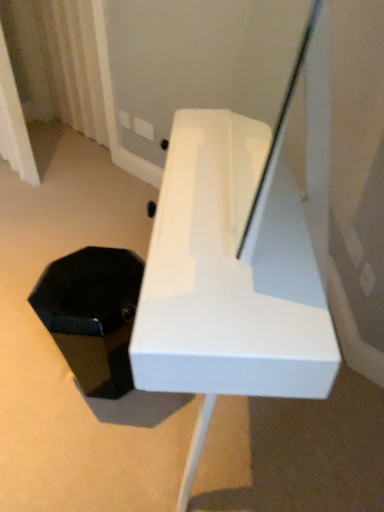
Locate an element on the screen. white sheer curtain at upper left is located at coordinates (73, 65).

Describe the element at coordinates (92, 315) in the screenshot. I see `black matte hexagonal box at lower left` at that location.

Locate an element on the screen. The width and height of the screenshot is (384, 512). white glossy bench at center is located at coordinates (229, 279).

From the picture: Does white glossy bench at center lie behind white sheer curtain at upper left?

No, white glossy bench at center is closer to the viewer.

Looking at this image, could you tell me if white glossy bench at center is facing white sheer curtain at upper left?

No, white glossy bench at center is not turned towards white sheer curtain at upper left.

Considering the sizes of objects white glossy bench at center and white sheer curtain at upper left in the image provided, who is shorter, white glossy bench at center or white sheer curtain at upper left?

With less height is white glossy bench at center.

In the scene shown: Is white glossy bench at center smaller than white sheer curtain at upper left?

No, white glossy bench at center is not smaller than white sheer curtain at upper left.

Can we say white sheer curtain at upper left lies outside black matte hexagonal box at lower left?

white sheer curtain at upper left is positioned outside black matte hexagonal box at lower left.

Which of these two, white sheer curtain at upper left or black matte hexagonal box at lower left, is wider?

Wider between the two is black matte hexagonal box at lower left.

From the picture: Is white sheer curtain at upper left at the left side of black matte hexagonal box at lower left?

Indeed, white sheer curtain at upper left is positioned on the left side of black matte hexagonal box at lower left.

From a real-world perspective, relative to black matte hexagonal box at lower left, is white sheer curtain at upper left vertically above or below?

From a real-world perspective, white sheer curtain at upper left is physically above black matte hexagonal box at lower left.

In the image, is black matte hexagonal box at lower left positioned in front of or behind white sheer curtain at upper left?

Visually, black matte hexagonal box at lower left is located in front of white sheer curtain at upper left.

Considering the relative positions of black matte hexagonal box at lower left and white sheer curtain at upper left in the image provided, is black matte hexagonal box at lower left to the left or to the right of white sheer curtain at upper left?

Clearly, black matte hexagonal box at lower left is on the right of white sheer curtain at upper left in the image.

Would you say black matte hexagonal box at lower left is a long distance from white sheer curtain at upper left?

Indeed, black matte hexagonal box at lower left is not near white sheer curtain at upper left.

Is black matte hexagonal box at lower left completely or partially outside of white sheer curtain at upper left?

Absolutely, black matte hexagonal box at lower left is external to white sheer curtain at upper left.

Is point (233, 287) positioned after point (107, 261)?

No, it is in front of (107, 261).

From the image's perspective, who appears lower, white glossy bench at center or black matte hexagonal box at lower left?

black matte hexagonal box at lower left appears lower in the image.

Which object is more forward, white glossy bench at center or black matte hexagonal box at lower left?

white glossy bench at center is closer to the camera.

Can you tell me how much white glossy bench at center and black matte hexagonal box at lower left differ in facing direction?

The angular difference between white glossy bench at center and black matte hexagonal box at lower left is 173 degrees.

Can you confirm if white sheer curtain at upper left is positioned to the left of white glossy bench at center?

Yes.

From a real-world perspective, between white sheer curtain at upper left and white glossy bench at center, who is vertically higher?

From a 3D spatial view, white sheer curtain at upper left is above.

Is white sheer curtain at upper left inside or outside of white glossy bench at center?

white sheer curtain at upper left is not enclosed by white glossy bench at center.

From a real-world perspective, relative to white glossy bench at center, is black matte hexagonal box at lower left vertically above or below?

From a real-world perspective, black matte hexagonal box at lower left is physically below white glossy bench at center.

How different are the orientations of black matte hexagonal box at lower left and white glossy bench at center in degrees?

black matte hexagonal box at lower left and white glossy bench at center are facing 173 degrees away from each other.

Considering the relative sizes of black matte hexagonal box at lower left and white glossy bench at center in the image provided, is black matte hexagonal box at lower left wider than white glossy bench at center?

No, black matte hexagonal box at lower left is not wider than white glossy bench at center.

Considering the relative sizes of black matte hexagonal box at lower left and white glossy bench at center in the image provided, is black matte hexagonal box at lower left bigger than white glossy bench at center?

Actually, black matte hexagonal box at lower left might be smaller than white glossy bench at center.

The image size is (384, 512). Identify the location of furniture below the white sheer curtain at upper left (from the image's perspective). (229, 279).

This screenshot has height=512, width=384. I want to click on curtain above the black matte hexagonal box at lower left (from a real-world perspective), so click(x=73, y=65).

Considering their positions, is white glossy bench at center positioned closer to white sheer curtain at upper left than black matte hexagonal box at lower left?

black matte hexagonal box at lower left lies closer to white sheer curtain at upper left than the other object.

From the image, which object appears to be nearer to black matte hexagonal box at lower left, white sheer curtain at upper left or white glossy bench at center?

white glossy bench at center is positioned closer to the anchor black matte hexagonal box at lower left.

Looking at the image, which one is located closer to white sheer curtain at upper left, black matte hexagonal box at lower left or white glossy bench at center?

black matte hexagonal box at lower left is positioned closer to the anchor white sheer curtain at upper left.

Based on their spatial positions, is black matte hexagonal box at lower left or white sheer curtain at upper left closer to white glossy bench at center?

black matte hexagonal box at lower left is positioned closer to the anchor white glossy bench at center.

Looking at the image, which one is located closer to white glossy bench at center, white sheer curtain at upper left or black matte hexagonal box at lower left?

black matte hexagonal box at lower left is positioned closer to the anchor white glossy bench at center.

From the image, which object appears to be farther from black matte hexagonal box at lower left, white glossy bench at center or white sheer curtain at upper left?

white sheer curtain at upper left is further to black matte hexagonal box at lower left.

Image resolution: width=384 pixels, height=512 pixels. In order to click on storage box between white glossy bench at center and white sheer curtain at upper left along the z-axis in this screenshot , I will do `click(92, 315)`.